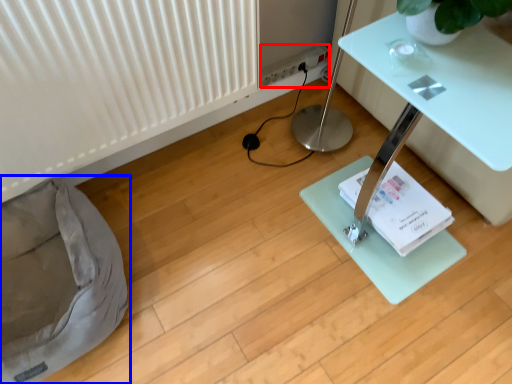
Question: Among these objects, which one is farthest to the camera, electric outlet (highlighted by a red box) or bean bag chair (highlighted by a blue box)?

Choices:
 (A) electric outlet
 (B) bean bag chair

Answer: (A)